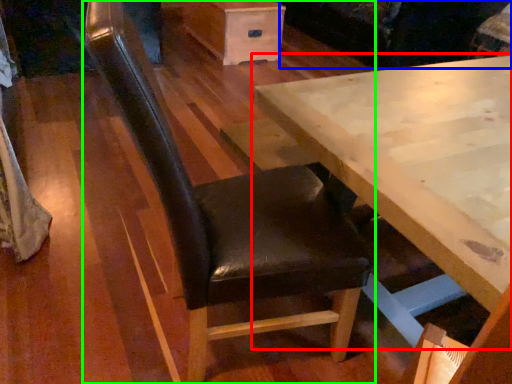
Question: Considering the real-world distances, which object is farthest from table (highlighted by a red box)? couch (highlighted by a blue box) or chair (highlighted by a green box)?

Choices:
 (A) couch
 (B) chair

Answer: (A)